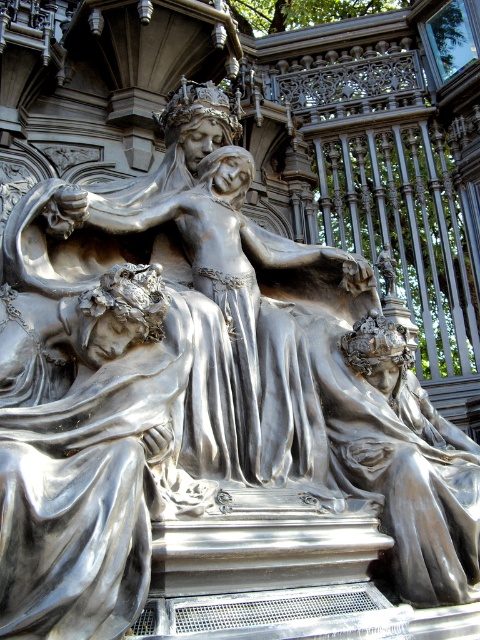
Can you confirm if shiny silver figure at lower left is positioned to the left of shiny silver statue at center?

Correct, you'll find shiny silver figure at lower left to the left of shiny silver statue at center.

Looking at this image, does shiny silver figure at lower left appear on the right side of shiny silver statue at center?

In fact, shiny silver figure at lower left is to the left of shiny silver statue at center.

What are the coordinates of `shiny silver figure at lower left` in the screenshot? It's located at (87, 467).

This screenshot has height=640, width=480. Find the location of `shiny silver figure at lower left`. shiny silver figure at lower left is located at coordinates (87, 467).